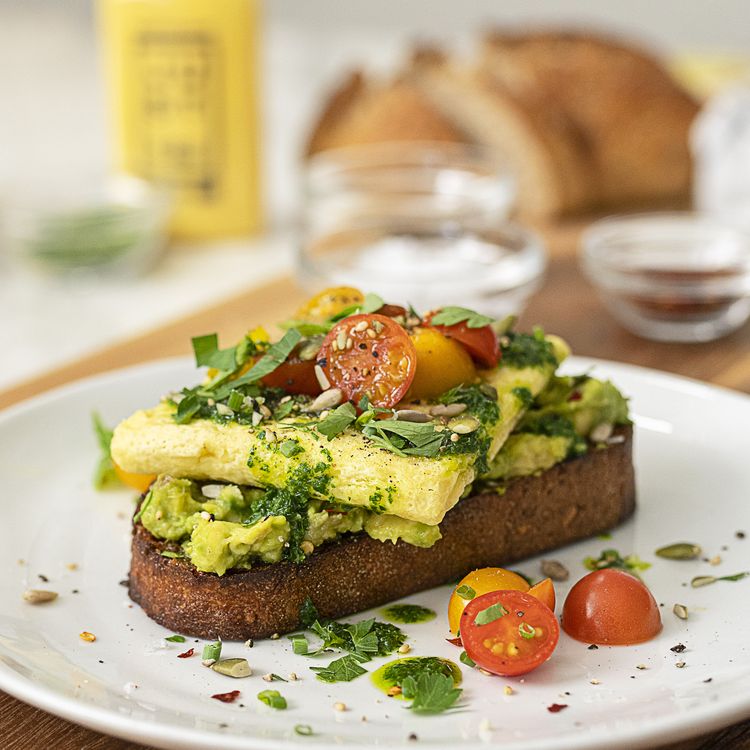
This screenshot has height=750, width=750. In order to click on plate in this screenshot , I will do `click(86, 532)`.